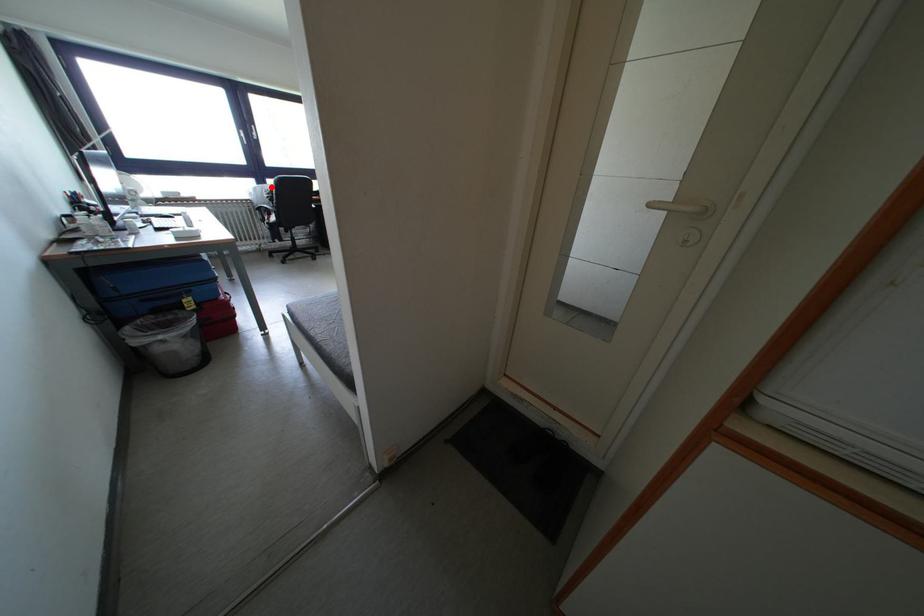
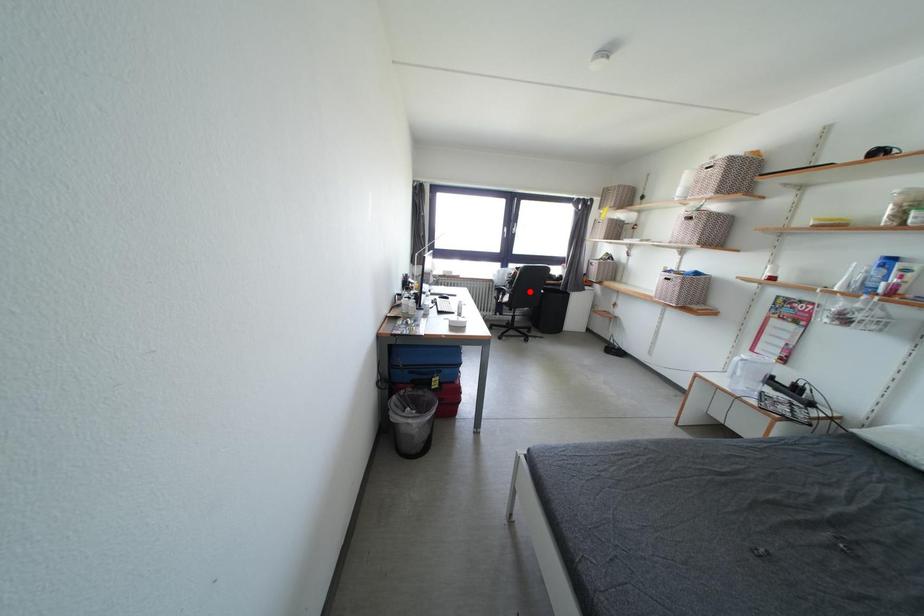
I am providing you with two images of the same scene from different viewpoints. A red point is marked on the first image and another point is marked on the second image. Is the red point in image1 aligned with the point shown in image2?

No